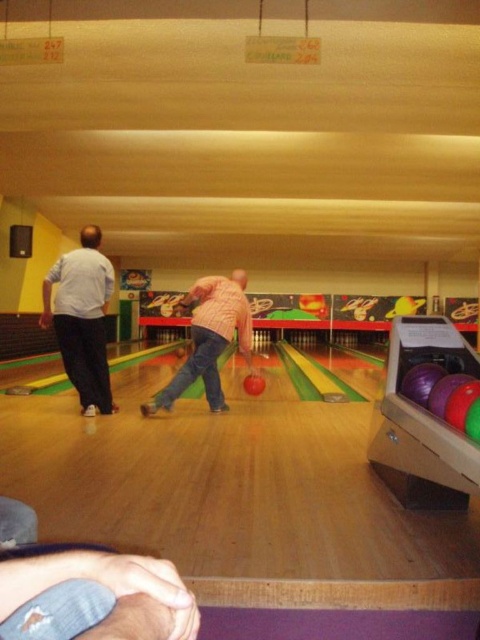
Is point (83, 376) positioned before point (193, 321)?

Yes, point (83, 376) is in front of point (193, 321).

Who is higher up, white matte shirt at left or pink matte shirt at center?

white matte shirt at left is higher up.

The width and height of the screenshot is (480, 640). I want to click on white matte shirt at left, so click(82, 317).

Locate an element on the screen. white matte shirt at left is located at coordinates (82, 317).